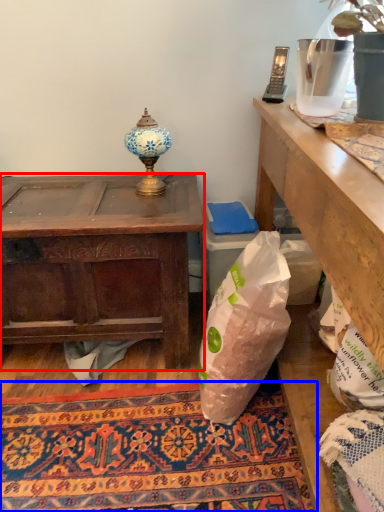
Question: Which object appears closest to the camera in this image, desk (highlighted by a red box) or mat (highlighted by a blue box)?

Choices:
 (A) desk
 (B) mat

Answer: (B)